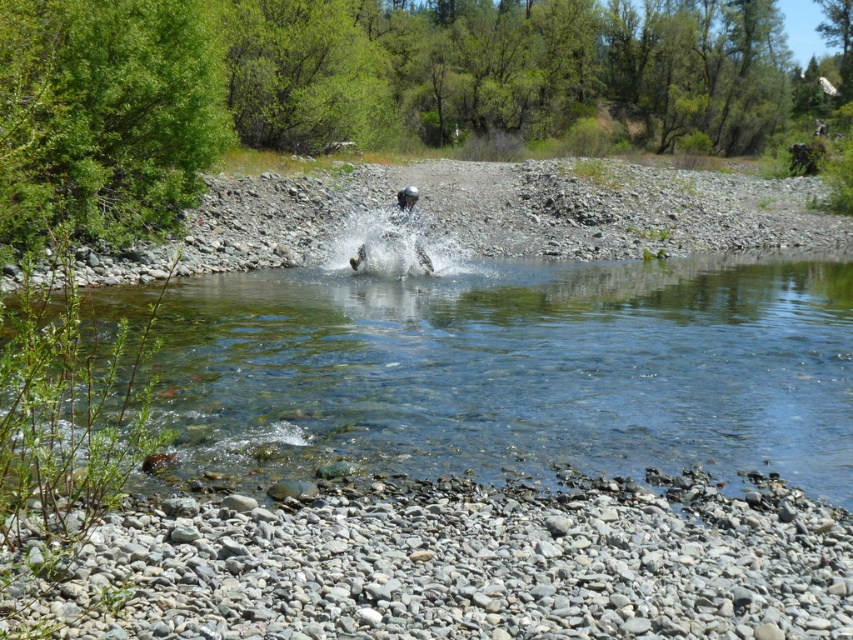
Question: Does gray gravel at lower center appear under clear water splash at center?

Choices:
 (A) no
 (B) yes

Answer: (B)

Question: Is clear glass lake at center closer to camera compared to gray gravel at lower center?

Choices:
 (A) yes
 (B) no

Answer: (B)

Question: Which object is closer to the camera taking this photo?

Choices:
 (A) clear glass lake at center
 (B) clear water splash at center

Answer: (A)

Question: Which of the following is the closest to the observer?

Choices:
 (A) gray gravel at lower center
 (B) clear water splash at center

Answer: (A)

Question: Does clear glass lake at center have a greater width compared to gray gravel at lower center?

Choices:
 (A) no
 (B) yes

Answer: (B)

Question: Which point appears closest to the camera in this image?

Choices:
 (A) (379, 262)
 (B) (767, 636)

Answer: (B)